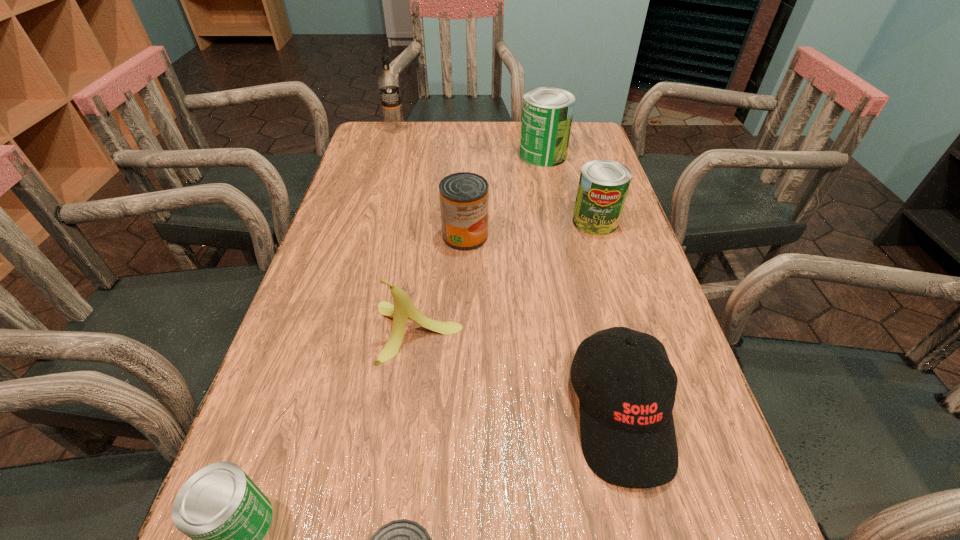
Find the location of a particular element. This screenshot has width=960, height=540. vodka is located at coordinates (388, 83).

I want to click on the farthest object, so click(388, 83).

Where is `the biggest green can`? The image size is (960, 540). the biggest green can is located at coordinates (547, 113).

Find the location of a particular element. the seventh shortest object is located at coordinates (547, 113).

At what (x,y) coordinates should I click in order to perform the action: click on the bigger red can. Please return your answer as a coordinate pair (x, y). The width and height of the screenshot is (960, 540). Looking at the image, I should click on (464, 196).

Image resolution: width=960 pixels, height=540 pixels. Identify the location of the second biggest green can. (603, 185).

Identify the location of banana. The image size is (960, 540). (403, 308).

You are a GUI agent. You are given a task and a screenshot of the screen. Output one action in this format:
    pyautogui.click(x=<x>, y=<y>)
    Task: Click on the baseball cap
    Image resolution: width=960 pixels, height=540 pixels.
    Given the screenshot: What is the action you would take?
    pyautogui.click(x=627, y=431)

Locate an element on the screen. Image resolution: width=960 pixels, height=540 pixels. vacant position located 0.390m on the label of the farthest object is located at coordinates (373, 205).

Find the location of a particular element. The width and height of the screenshot is (960, 540). free spot located on the left of the farthest green can is located at coordinates (470, 155).